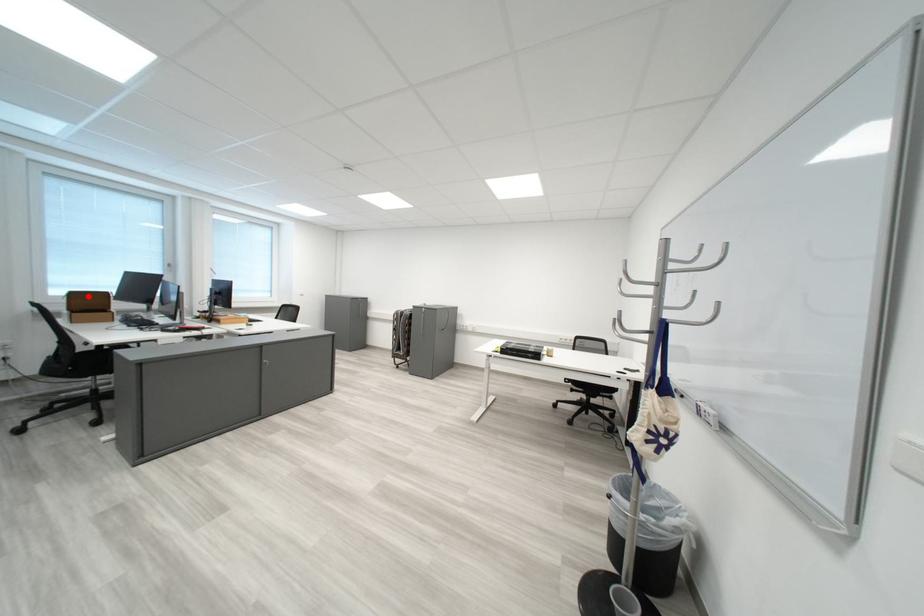
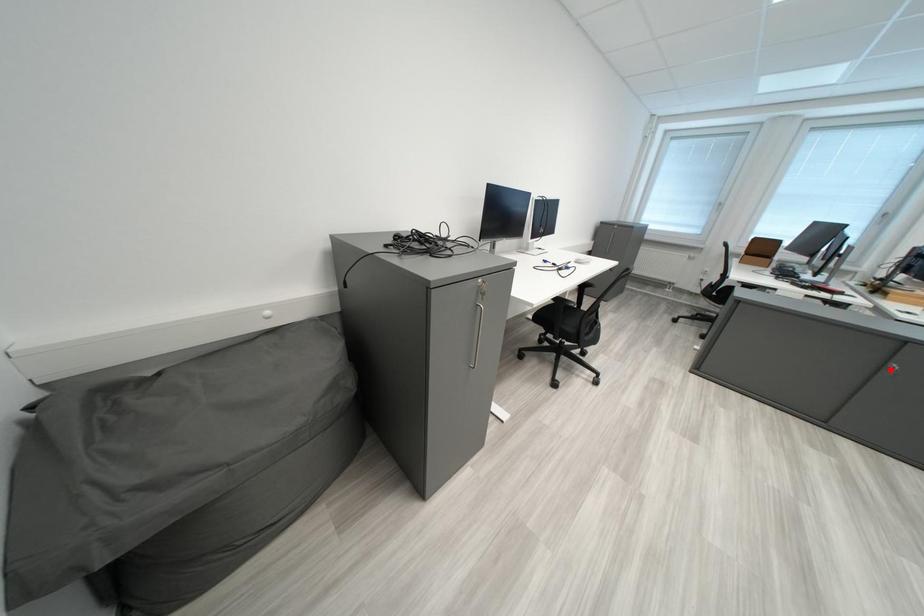
I am providing you with two images of the same scene from different viewpoints. A red point is marked on the first image and another point is marked on the second image. Is the red point in image1 aligned with the point shown in image2?

No